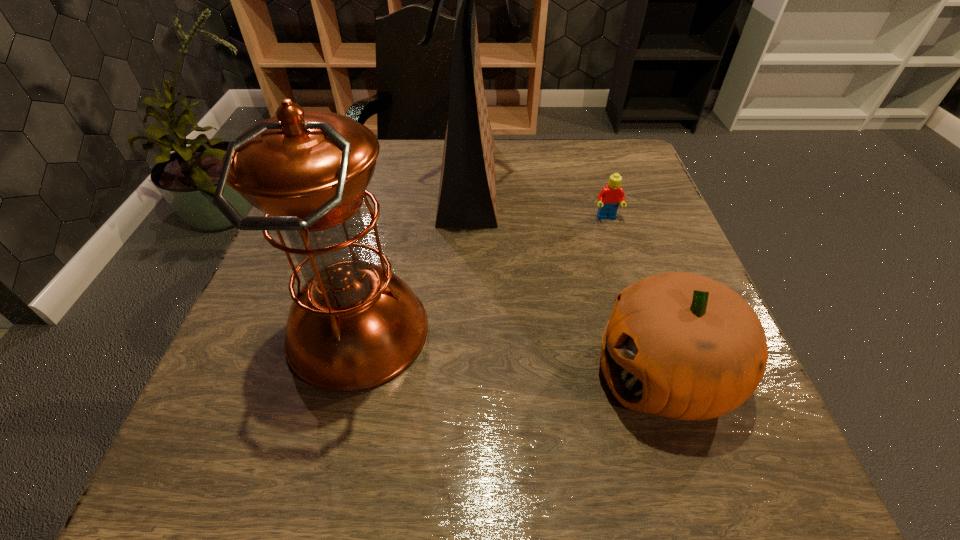
Where is `the tallest object`? The image size is (960, 540). the tallest object is located at coordinates (467, 194).

Image resolution: width=960 pixels, height=540 pixels. Find the location of `oil lamp`. oil lamp is located at coordinates (353, 325).

This screenshot has width=960, height=540. What are the coordinates of `the third tallest object` in the screenshot? It's located at (680, 345).

Locate an element on the screen. The width and height of the screenshot is (960, 540). Lego is located at coordinates (610, 197).

Locate an element on the screen. This screenshot has height=540, width=960. free location located on the front-facing side of the shopping bag is located at coordinates (649, 181).

Find the location of a particular element. Image resolution: width=960 pixels, height=540 pixels. free region located 0.180m on the back of the oil lamp is located at coordinates (385, 221).

You are a GUI agent. You are given a task and a screenshot of the screen. Output one action in this format:
    pyautogui.click(x=<x>, y=<y>)
    Task: Click on the vacant space located on the face of the pumpkin
    The image size is (960, 540).
    Given the screenshot: What is the action you would take?
    pyautogui.click(x=444, y=373)

You are a GUI agent. You are given a task and a screenshot of the screen. Output one action in this format:
    pyautogui.click(x=<x>, y=<y>)
    Task: Click on the free point located on the face of the pumpkin
    
    Given the screenshot: What is the action you would take?
    pyautogui.click(x=424, y=373)

The image size is (960, 540). Identify the location of vacant space located 0.390m on the face of the pumpkin. (348, 373).

Locate an element on the screen. The width and height of the screenshot is (960, 540). vacant space located on the face of the shortest object is located at coordinates (644, 334).